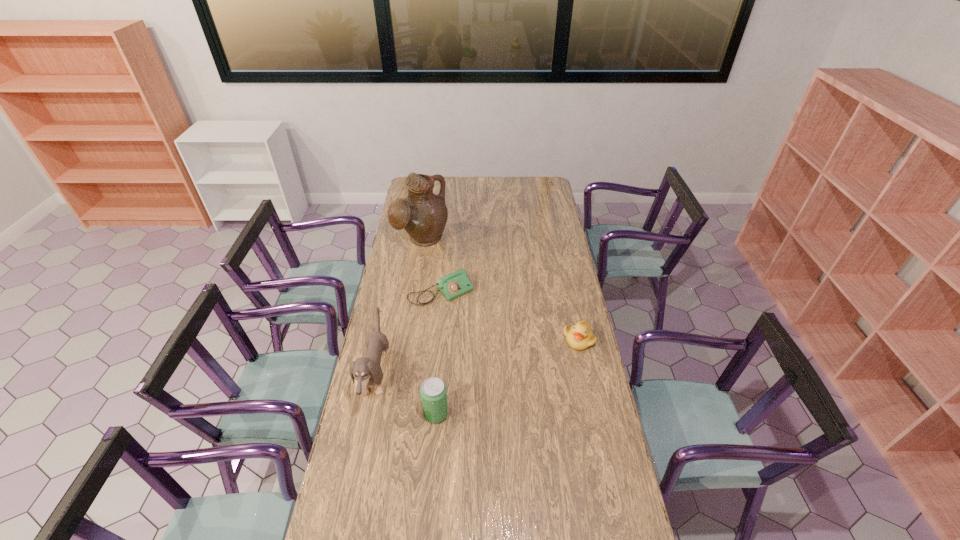
The height and width of the screenshot is (540, 960). Find the location of `the third tallest object`. the third tallest object is located at coordinates (433, 392).

The height and width of the screenshot is (540, 960). Identify the location of the rightmost object. (579, 337).

Identify the location of duckling. (579, 337).

The height and width of the screenshot is (540, 960). What are the coordinates of `the shortest object` in the screenshot? It's located at (455, 284).

Locate an element on the screen. This screenshot has height=540, width=960. the fourth nearest object is located at coordinates (455, 284).

Locate an element on the screen. This screenshot has width=960, height=540. pitcher is located at coordinates (423, 215).

The height and width of the screenshot is (540, 960). Find the location of `the farthest object`. the farthest object is located at coordinates (423, 215).

The height and width of the screenshot is (540, 960). I want to click on puppy, so click(366, 371).

Locate an element on the screen. blank space located on the front of the third shortest object is located at coordinates (434, 438).

Identify the location of vacant space positioned on the front-facing side of the rightmost object. This screenshot has height=540, width=960. (586, 372).